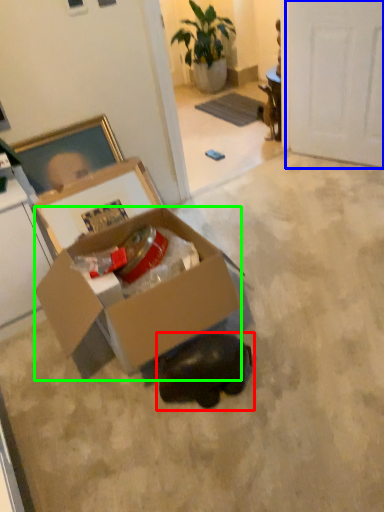
Question: Which object is positioned closest to animal (highlighted by a red box)? Select from door (highlighted by a blue box) and box (highlighted by a green box).

Choices:
 (A) door
 (B) box

Answer: (B)